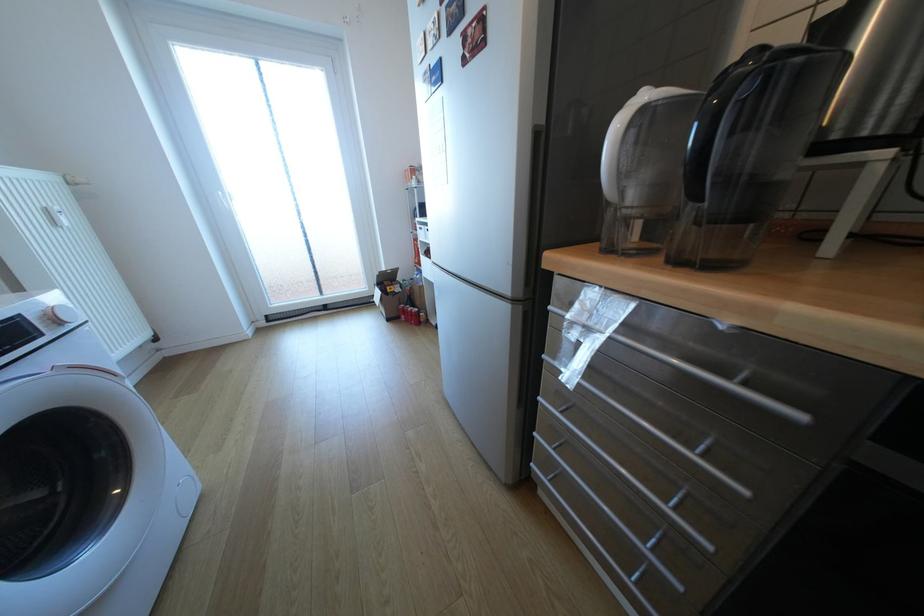
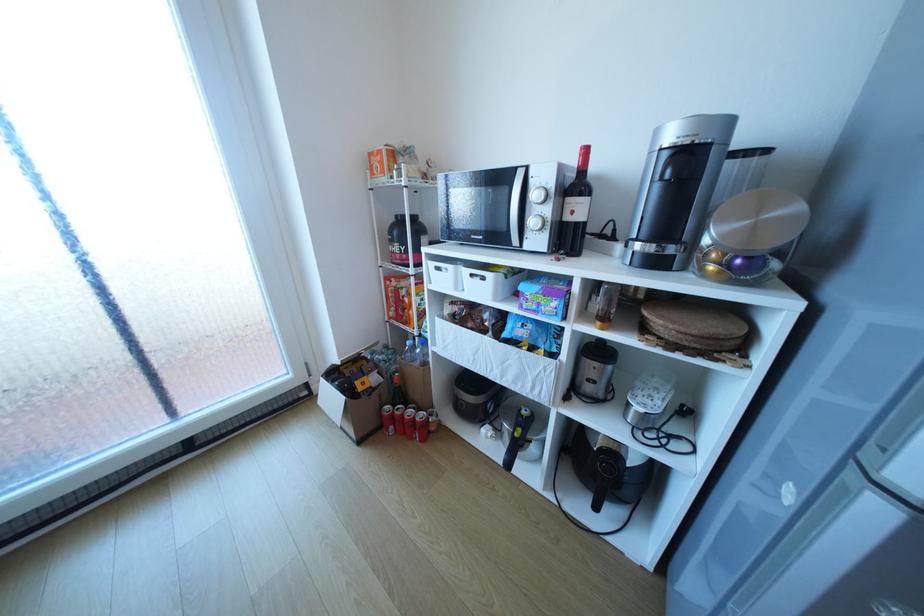
Question: I am providing you with two images of the same scene from different viewpoints. Please identify which objects are invisible in image2.

Choices:
 (A) black pot handle
 (B) microwave handle
 (C) red soda can
 (D) none of these

Answer: (D)